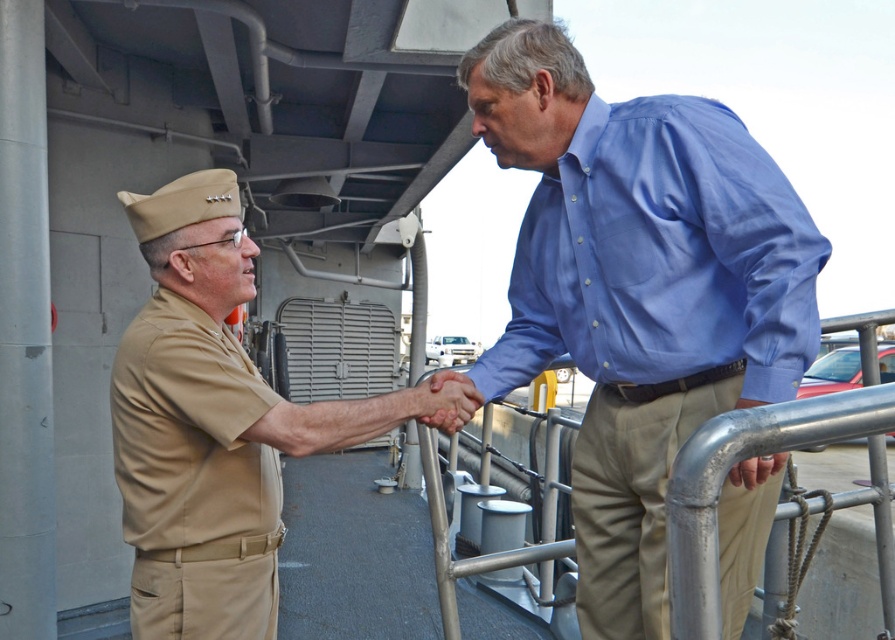
Looking at this image, you are navigating a naval ship deck and need to locate the khaki uniform at center. What are the coordinates where you can find it?

The khaki uniform at center is located at coordinates point (637, 291).